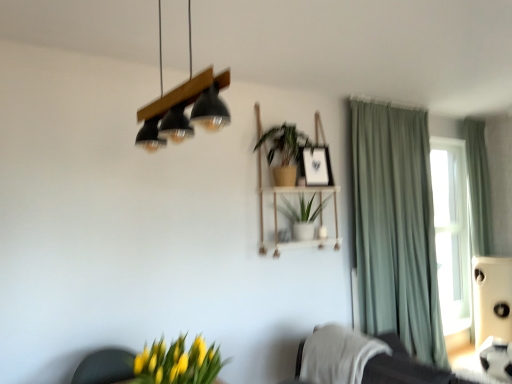
What do you see at coordinates (316, 166) in the screenshot?
I see `matte black picture frame at upper center` at bounding box center [316, 166].

What is the approximate height of white textured towel at lower right?

19.37 inches.

Image resolution: width=512 pixels, height=384 pixels. Describe the element at coordinates (183, 105) in the screenshot. I see `woodenblacklamp at upper center` at that location.

Where is `green fabric curtain at right, the 2th curtain in the right-to-left sequence`? This screenshot has height=384, width=512. green fabric curtain at right, the 2th curtain in the right-to-left sequence is located at coordinates (396, 228).

The image size is (512, 384). In order to click on yellow-green leaves at lower left, which appears as the 1th houseplant when ordered from the bottom in this screenshot , I will do `click(178, 363)`.

This screenshot has width=512, height=384. Identify the location of green fabric curtain at right, placed as the 2th curtain when sorted from front to back. (478, 188).

This screenshot has height=384, width=512. I want to click on matte black picture frame at upper center, so click(x=316, y=166).

Considering the sizes of objects white textured blanket at lower right and white textured towel at lower right in the image provided, who is smaller, white textured blanket at lower right or white textured towel at lower right?

Smaller between the two is white textured towel at lower right.

Does white textured blanket at lower right turn towards white textured towel at lower right?

No, white textured blanket at lower right is not turned towards white textured towel at lower right.

Is white textured blanket at lower right wider or thinner than white textured towel at lower right?

white textured blanket at lower right is wider than white textured towel at lower right.

From a real-world perspective, is white textured blanket at lower right physically below white textured towel at lower right?

Correct, in the physical world, white textured blanket at lower right is lower than white textured towel at lower right.

Can white textured towel at lower right be found inside white wooden shelf at upper center?

Actually, white textured towel at lower right is outside white wooden shelf at upper center.

From a real-world perspective, is white wooden shelf at upper center positioned over white textured towel at lower right based on gravity?

Yes.

Are white wooden shelf at upper center and white textured towel at lower right making contact?

No, white wooden shelf at upper center is not making contact with white textured towel at lower right.

Does point (274, 192) come farther from viewer compared to point (335, 334)?

Yes, point (274, 192) is behind point (335, 334).

Is white textured towel at lower right facing towards green matte plant at center, positioned as the second houseplant in bottom-to-top order?

No, white textured towel at lower right is not turned towards green matte plant at center, positioned as the second houseplant in bottom-to-top order.

Considering the relative sizes of white textured towel at lower right and green matte plant at center, which ranks as the first houseplant in back-to-front order, in the image provided, is white textured towel at lower right wider than green matte plant at center, which ranks as the first houseplant in back-to-front order,?

Indeed, white textured towel at lower right has a greater width compared to green matte plant at center, which ranks as the first houseplant in back-to-front order.

What's the angular difference between white textured towel at lower right and green matte plant at center, positioned as the second houseplant in bottom-to-top order,'s facing directions?

They differ by 90 degrees in their facing directions.

Considering the sizes of white textured towel at lower right and green matte plant at center, the second houseplant when ordered from top to bottom, in the image, is white textured towel at lower right taller or shorter than green matte plant at center, the second houseplant when ordered from top to bottom,?

In the image, white textured towel at lower right appears to be taller than green matte plant at center, the second houseplant when ordered from top to bottom.

Based on the photo, would you say matte black picture frame at upper center is part of green fabric curtain at right, the 2th curtain in the right-to-left sequence,'s contents?

No, matte black picture frame at upper center is not inside green fabric curtain at right, the 2th curtain in the right-to-left sequence.

Are green fabric curtain at right, marked as the first curtain in a left-to-right arrangement, and matte black picture frame at upper center making contact?

No, green fabric curtain at right, marked as the first curtain in a left-to-right arrangement, is not with matte black picture frame at upper center.

Does green fabric curtain at right, the 2th curtain positioned from the back, turn towards matte black picture frame at upper center?

No, green fabric curtain at right, the 2th curtain positioned from the back, is not turned towards matte black picture frame at upper center.

Between point (417, 186) and point (317, 177), which one is positioned in front?

The point (317, 177) is closer to the camera.

Considering the sizes of green matte plant at center, which is the third houseplant in front-to-back order, and green matte plant at center, the third houseplant positioned from the bottom, in the image, is green matte plant at center, which is the third houseplant in front-to-back order, taller or shorter than green matte plant at center, the third houseplant positioned from the bottom,?

green matte plant at center, which is the third houseplant in front-to-back order, is shorter than green matte plant at center, the third houseplant positioned from the bottom.

Where is `houseplant that is above the green matte plant at center, the second houseplant when ordered from top to bottom (from a real-world perspective)`? The width and height of the screenshot is (512, 384). houseplant that is above the green matte plant at center, the second houseplant when ordered from top to bottom (from a real-world perspective) is located at coordinates (284, 151).

Is green matte plant at center, which ranks as the first houseplant in back-to-front order, not near green matte plant at center, the second houseplant in the back-to-front sequence?

No.

What are the coordinates of `gray in front of the green fabric curtain at right, the 2th curtain in the right-to-left sequence` in the screenshot? It's located at coord(338,355).

From the image's perspective, between green fabric curtain at right, the 2th curtain positioned from the back, and white textured towel at lower right, who is located below?

white textured towel at lower right appears lower in the image.

Can you confirm if green fabric curtain at right, the 1th curtain when ordered from front to back, is bigger than white textured towel at lower right?

Correct, green fabric curtain at right, the 1th curtain when ordered from front to back, is larger in size than white textured towel at lower right.

Would you say green fabric curtain at right, marked as the first curtain in a left-to-right arrangement, is to the left or to the right of white textured towel at lower right in the picture?

Based on their positions, green fabric curtain at right, marked as the first curtain in a left-to-right arrangement, is located to the right of white textured towel at lower right.

Can you confirm if matte black picture frame at upper center is taller than white textured towel at lower right?

Incorrect, the height of matte black picture frame at upper center is not larger of that of white textured towel at lower right.

Is matte black picture frame at upper center positioned with its back to white textured towel at lower right?

No.

Does matte black picture frame at upper center touch white textured towel at lower right?

No, matte black picture frame at upper center is not next to white textured towel at lower right.

From a real-world perspective, is matte black picture frame at upper center positioned under white textured towel at lower right based on gravity?

No, from a real-world perspective, matte black picture frame at upper center is not beneath white textured towel at lower right.

Locate an element on the screen. Image resolution: width=512 pixels, height=384 pixels. gray above the white textured blanket at lower right (from the image's perspective) is located at coordinates (338, 355).

Identify the location of gray below the white wooden shelf at upper center (from a real-world perspective). The image size is (512, 384). (338, 355).

Estimate the real-world distances between objects in this image. Which object is further from white wooden shelf at upper center, woodenblacklamp at upper center or white textured towel at lower right?

woodenblacklamp at upper center.

Looking at the image, which one is located further to green matte plant at center, positioned as the second houseplant in bottom-to-top order, green matte plant at center, acting as the 2th houseplant starting from the front, or matte black picture frame at upper center?

green matte plant at center, acting as the 2th houseplant starting from the front, is positioned further to the anchor green matte plant at center, positioned as the second houseplant in bottom-to-top order.

Looking at the image, which one is located closer to matte black picture frame at upper center, green matte plant at center, positioned as the second houseplant in bottom-to-top order, or green fabric curtain at right, which is counted as the second curtain, starting from the left?

The object closer to matte black picture frame at upper center is green matte plant at center, positioned as the second houseplant in bottom-to-top order.

Estimate the real-world distances between objects in this image. Which object is further from green matte plant at center, acting as the 2th houseplant starting from the front, white wooden shelf at upper center or green fabric curtain at right, the 1th curtain positioned from the back?

The object further to green matte plant at center, acting as the 2th houseplant starting from the front, is green fabric curtain at right, the 1th curtain positioned from the back.

From the image, which object appears to be nearer to green fabric curtain at right, placed as the first curtain when sorted from right to left, green fabric curtain at right, marked as the first curtain in a left-to-right arrangement, or green matte plant at center, acting as the 2th houseplant starting from the front?

The object closer to green fabric curtain at right, placed as the first curtain when sorted from right to left, is green fabric curtain at right, marked as the first curtain in a left-to-right arrangement.

From the image, which object appears to be farther from woodenblacklamp at upper center, green fabric curtain at right, the 1th curtain positioned from the back, or white textured towel at lower right?

Among the two, green fabric curtain at right, the 1th curtain positioned from the back, is located further to woodenblacklamp at upper center.

Consider the image. Based on their spatial positions, is green matte plant at center, the second houseplant when ordered from top to bottom, or green fabric curtain at right, the 1th curtain when ordered from front to back, further from green matte plant at center, which is the 1th houseplant from top to bottom?

Among the two, green fabric curtain at right, the 1th curtain when ordered from front to back, is located further to green matte plant at center, which is the 1th houseplant from top to bottom.

Looking at the image, which one is located further to white textured blanket at lower right, green fabric curtain at right, which is counted as the second curtain, starting from the left, or yellow-green leaves at lower left, which appears as the 1th houseplant when ordered from the bottom?

green fabric curtain at right, which is counted as the second curtain, starting from the left, lies further to white textured blanket at lower right than the other object.

The image size is (512, 384). I want to click on lamp between yellow-green leaves at lower left, which is counted as the third houseplant, starting from the top, and green fabric curtain at right, the 2th curtain positioned from the back, along the z-axis, so click(183, 105).

Locate an element on the screen. The width and height of the screenshot is (512, 384). shelf positioned between green matte plant at center, acting as the 2th houseplant starting from the front, and matte black picture frame at upper center from near to far is located at coordinates (274, 206).

At what (x,y) coordinates should I click in order to perform the action: click on gray between yellow-green leaves at lower left, which appears as the 1th houseplant when ordered from the bottom, and white textured blanket at lower right. Please return your answer as a coordinate pair (x, y). Looking at the image, I should click on (338, 355).

Find the location of `curtain between woodenblacklamp at upper center and green fabric curtain at right, the 1th curtain positioned from the back, along the z-axis`. curtain between woodenblacklamp at upper center and green fabric curtain at right, the 1th curtain positioned from the back, along the z-axis is located at coordinates (396, 228).